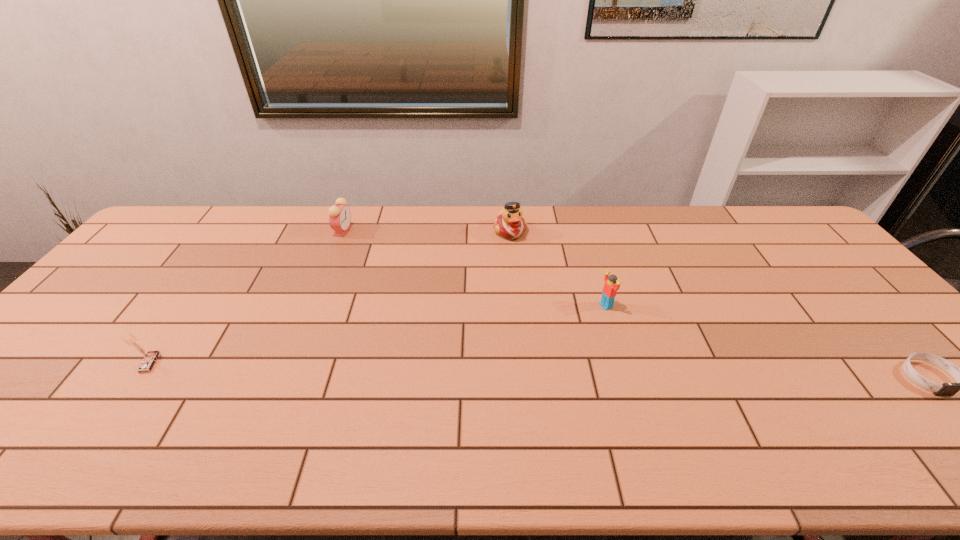
Identify the location of free space on the desktop that is between the matchbox and the shortest object and is positioned on the face of the Lego. The image size is (960, 540). (465, 369).

You are a GUI agent. You are given a task and a screenshot of the screen. Output one action in this format:
    pyautogui.click(x=<x>, y=<y>)
    Task: Click on the vacant space on the desktop that is between the matchbox and the wristband and is positioned on the face of the alarm clock
    The image size is (960, 540).
    Given the screenshot: What is the action you would take?
    pyautogui.click(x=484, y=369)

Locate an element on the screen. This screenshot has height=540, width=960. free space on the desktop that is between the leftmost object and the shortest object and is positioned on the face of the third object from left to right is located at coordinates coord(596,372).